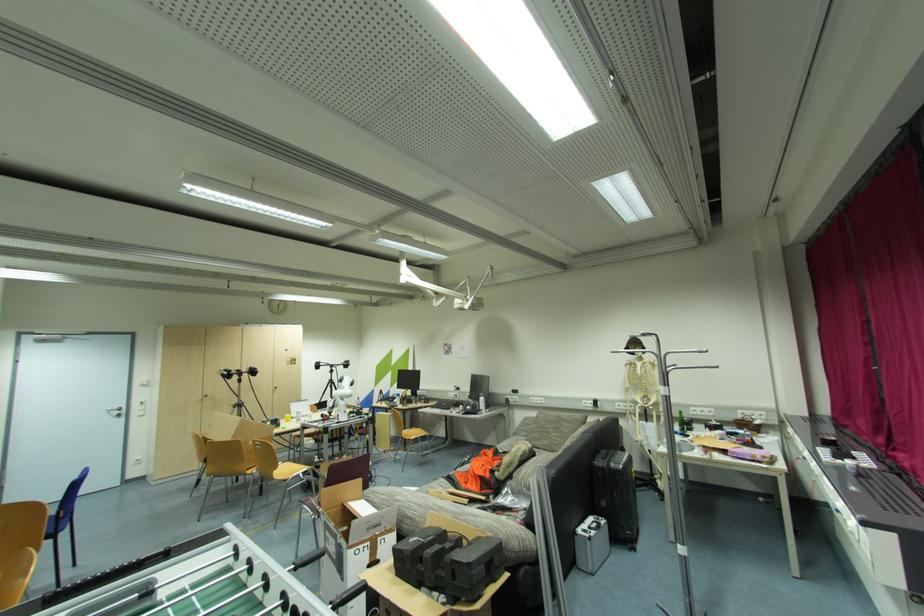
You are a GUI agent. You are given a task and a screenshot of the screen. Output one action in this format:
    pyautogui.click(x=<x>, y=<y>)
    Task: Click on the large cardboard box
    The image size is (924, 616).
    Given the screenshot: What is the action you would take?
    pyautogui.click(x=339, y=493)